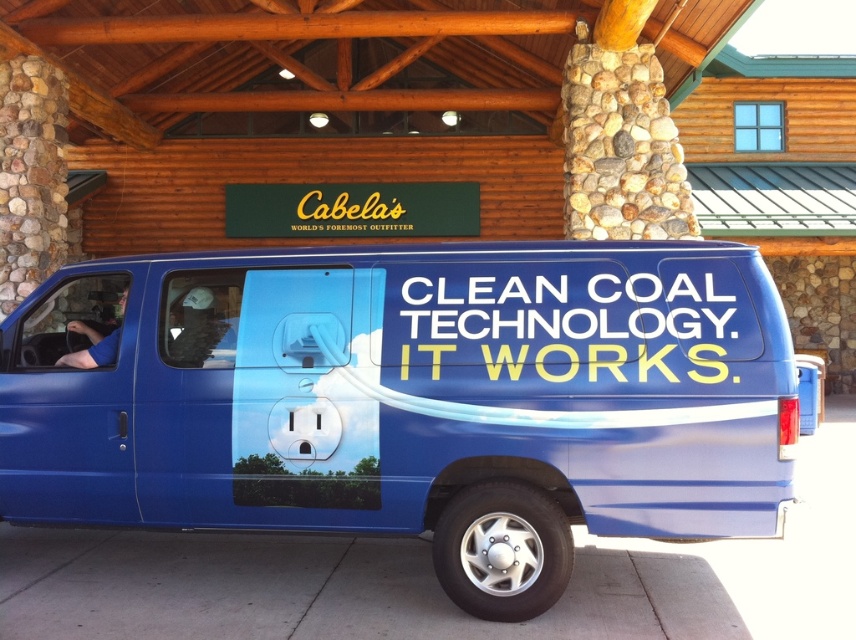
Which is behind, point (461, 554) or point (76, 358)?

The point (76, 358) is more distant.

Does point (732, 353) come closer to viewer compared to point (122, 298)?

Yes, point (732, 353) is in front of point (122, 298).

What are the coordinates of `blue metallic van at center` in the screenshot? It's located at (412, 400).